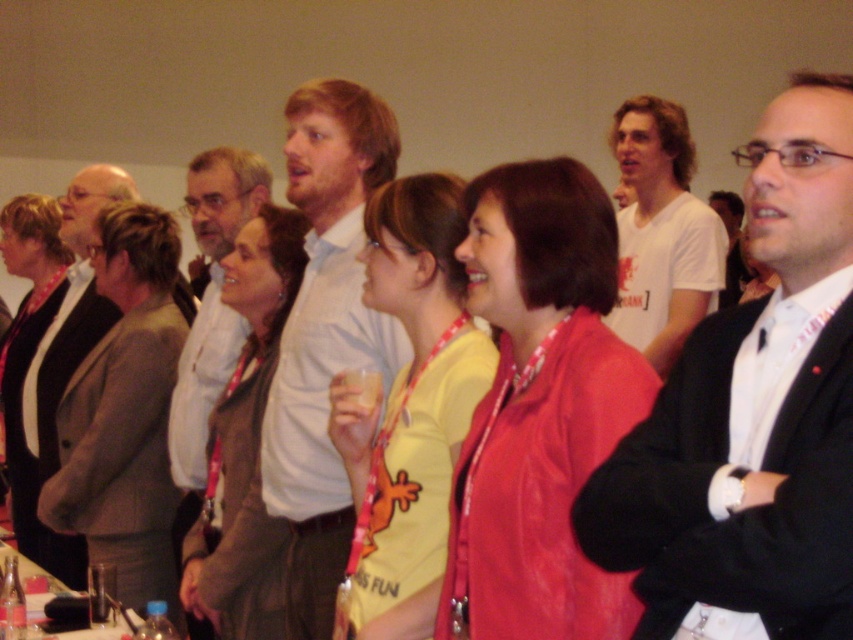
Is point (302, 628) behind point (338, 435)?

Yes, it is behind point (338, 435).

Between light blue shirt at center and yellow fabric shirt at center, which one is positioned lower?

Positioned lower is yellow fabric shirt at center.

Which is in front, point (329, 307) or point (421, 410)?

Point (421, 410) is in front.

At what (x,y) coordinates should I click in order to perform the action: click on light blue shirt at center. Please return your answer as a coordinate pair (x, y). This screenshot has height=640, width=853. Looking at the image, I should click on [x=325, y=333].

Who is positioned more to the left, brown leather jacket at center or white cotton t-shirt at upper right?

brown leather jacket at center is more to the left.

Which is below, brown leather jacket at center or white cotton t-shirt at upper right?

Positioned lower is brown leather jacket at center.

Which is in front, point (207, 554) or point (670, 356)?

Point (207, 554) is more forward.

Where is `brown leather jacket at center`? The width and height of the screenshot is (853, 640). brown leather jacket at center is located at coordinates (245, 444).

Find the location of a particular element. black suit at right is located at coordinates (752, 416).

Between black suit at right and light brown leather jacket at left, which one appears on the left side from the viewer's perspective?

light brown leather jacket at left

Is point (744, 552) farther from camera compared to point (113, 172)?

No.

Find the location of a particular element. The width and height of the screenshot is (853, 640). black suit at right is located at coordinates (752, 416).